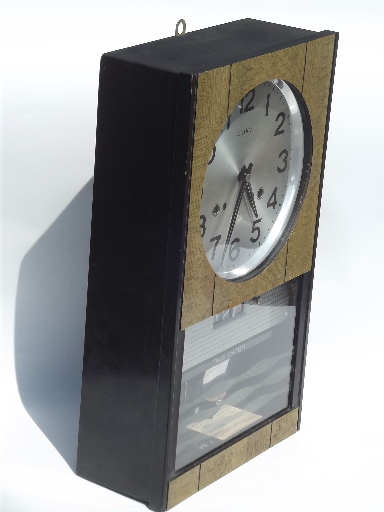
You are a GUI agent. You are given a task and a screenshot of the screen. Output one action in this format:
    pyautogui.click(x=<x>, y=<y>)
    Task: Click on the clock
    The height and width of the screenshot is (512, 384).
    Given the screenshot: What is the action you would take?
    pyautogui.click(x=229, y=181)